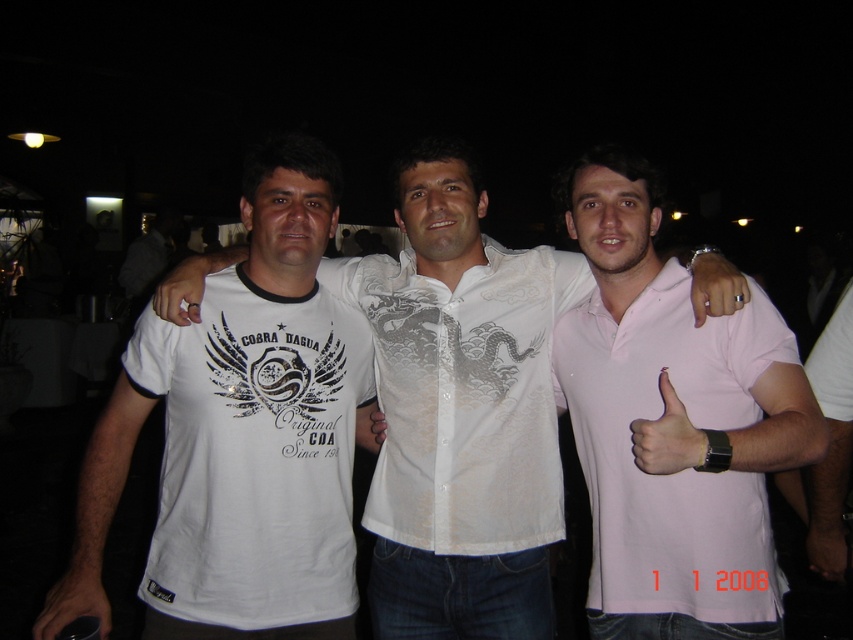
Who is shorter, white cotton t-shirt at left or black matte hand at lower left?

Standing shorter between the two is black matte hand at lower left.

Can you confirm if white cotton t-shirt at left is taller than black matte hand at lower left?

Indeed, white cotton t-shirt at left has a greater height compared to black matte hand at lower left.

Which is in front, point (347, 532) or point (61, 612)?

Point (61, 612) is in front.

Find the location of a particular element. This screenshot has height=640, width=853. white cotton t-shirt at left is located at coordinates (254, 454).

Which is below, white cotton t-shirt at left or matte white ring at center?

white cotton t-shirt at left

Is point (138, 356) in front of point (161, 316)?

No, it is not.

Identify the location of white cotton t-shirt at left. (254, 454).

Can you confirm if black matte hand at lower left is positioned below matte white ring at center?

Indeed, black matte hand at lower left is positioned under matte white ring at center.

You are a GUI agent. You are given a task and a screenshot of the screen. Output one action in this format:
    pyautogui.click(x=<x>, y=<y>)
    Task: Click on the black matte hand at lower left
    
    Given the screenshot: What is the action you would take?
    pyautogui.click(x=74, y=602)

Find the location of a particular element. This screenshot has width=853, height=640. black matte hand at lower left is located at coordinates (74, 602).